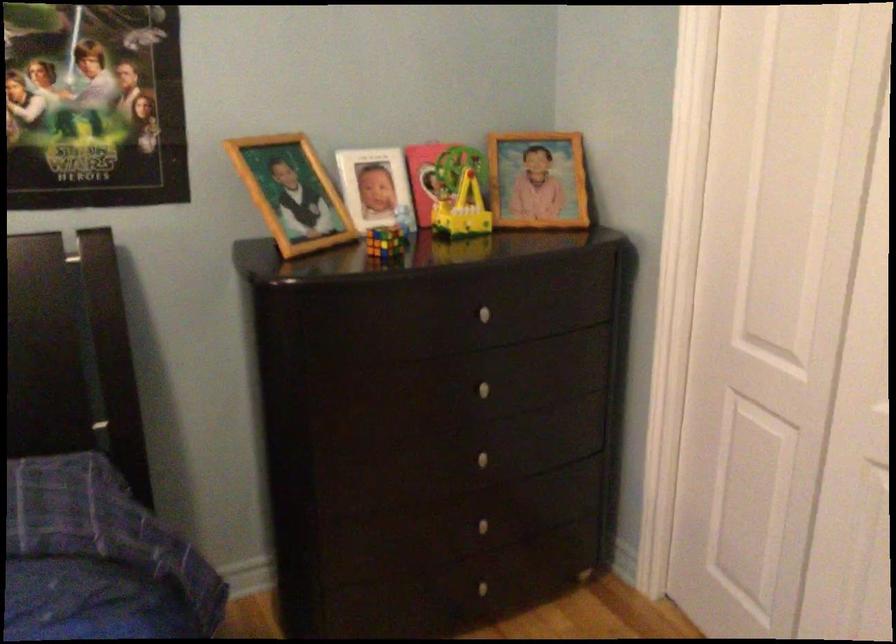
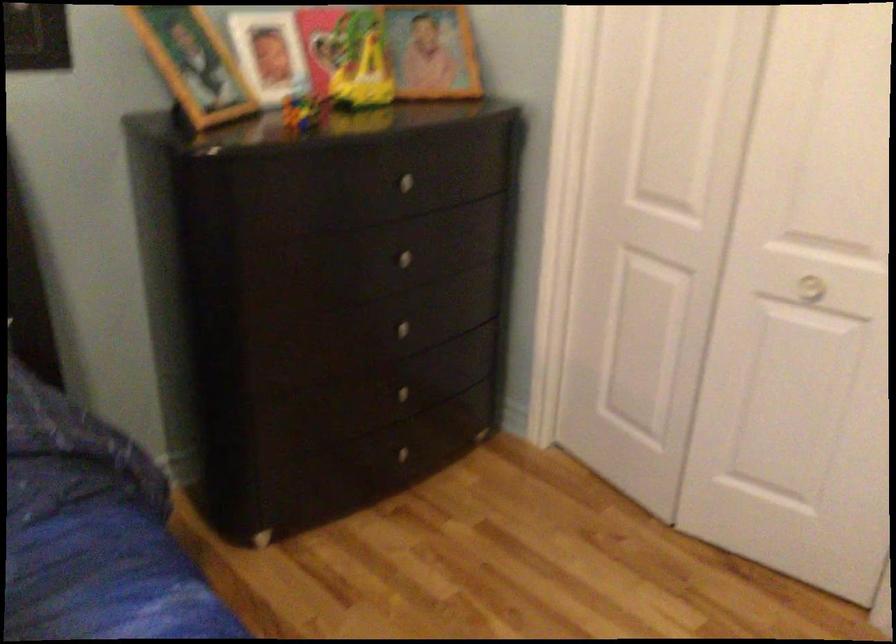
In the second image, find the point that corresponds to (x=385, y=240) in the first image.

(303, 111)